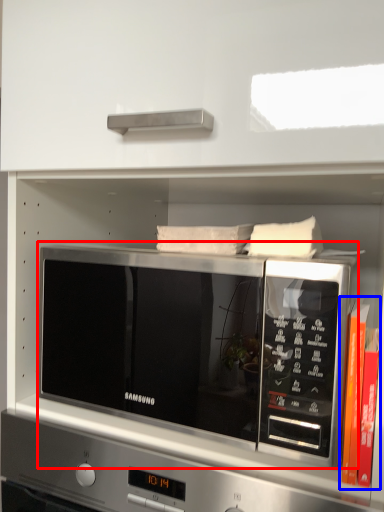
Question: Which object appears closest to the camera in this image, microwave oven (highlighted by a red box) or book (highlighted by a blue box)?

Choices:
 (A) microwave oven
 (B) book

Answer: (A)